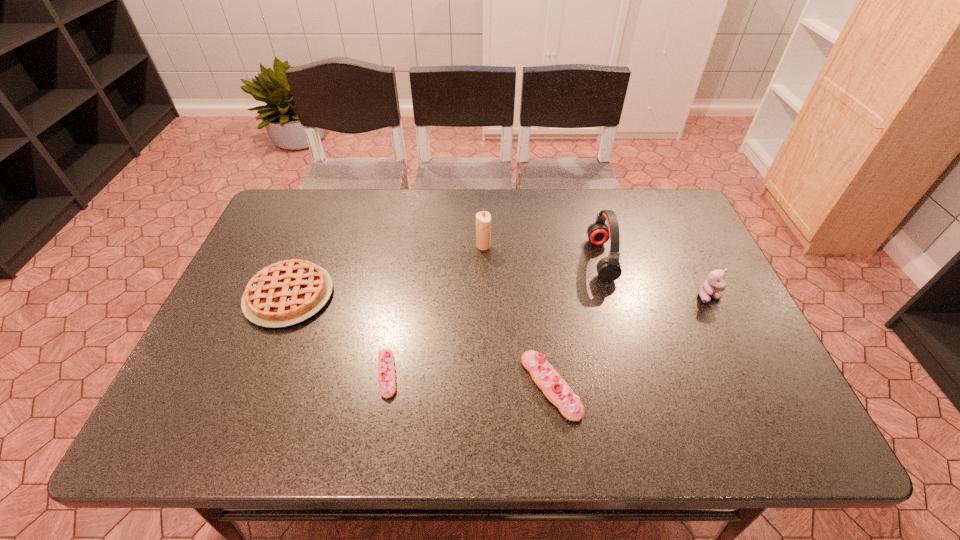
I want to click on empty location between the shortest object and the pie, so click(x=338, y=335).

At what (x,y) coordinates should I click in order to perform the action: click on free space between the pie and the second object from left to right. Please return your answer as a coordinate pair (x, y). The height and width of the screenshot is (540, 960). Looking at the image, I should click on (338, 335).

This screenshot has height=540, width=960. I want to click on free space between the shorter eclair and the taller eclair, so click(x=469, y=380).

Locate an element on the screen. The width and height of the screenshot is (960, 540). vacant space that is in between the pie and the fourth object from right to left is located at coordinates (386, 271).

Locate an element on the screen. Image resolution: width=960 pixels, height=540 pixels. empty space that is in between the teddy bear and the second object from left to right is located at coordinates (548, 335).

Identify the location of object that can be found as the closest to the earphone. (714, 285).

I want to click on object that is the fourth nearest to the leftmost object, so click(x=608, y=268).